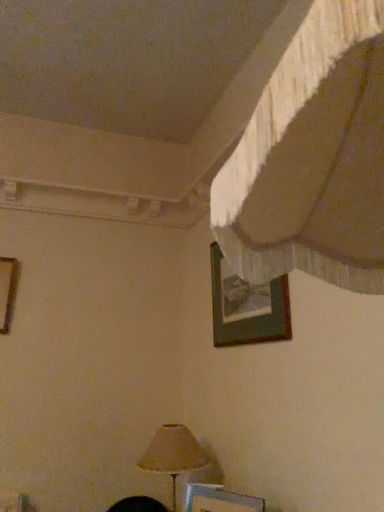
Question: Considering the relative positions of wooden picture frame at left, which is the 2th picture frame in top-to-bottom order, and wooden picture frame at upper center, which is counted as the third picture frame, starting from the left, in the image provided, is wooden picture frame at left, which is the 2th picture frame in top-to-bottom order, to the left or to the right of wooden picture frame at upper center, which is counted as the third picture frame, starting from the left,?

Choices:
 (A) right
 (B) left

Answer: (B)

Question: Is point (13, 275) positioned closer to the camera than point (225, 311)?

Choices:
 (A) closer
 (B) farther

Answer: (B)

Question: Which object is the closest to the wooden picture frame at upper center, which ranks as the third picture frame in bottom-to-top order?

Choices:
 (A) metallic silver picture frame at lower center, the 1th picture frame when ordered from bottom to top
 (B) wooden picture frame at left, which is the 2th picture frame in top-to-bottom order
 (C) matte beige lampshade at lower center

Answer: (C)

Question: Based on their relative distances, which object is nearer to the wooden picture frame at upper center, placed as the first picture frame when sorted from right to left?

Choices:
 (A) metallic silver picture frame at lower center, the 2th picture frame positioned from the right
 (B) matte beige lampshade at lower center
 (C) wooden picture frame at left, which is the 2th picture frame in top-to-bottom order

Answer: (B)